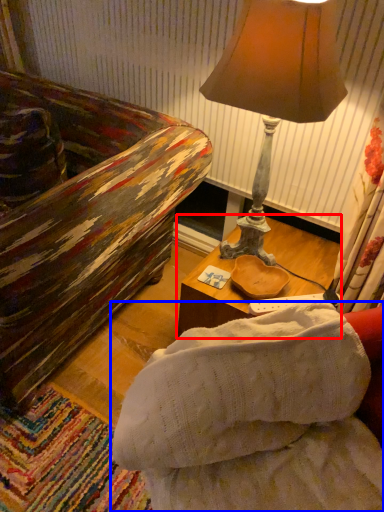
Question: Which object appears closest to the camera in this image, table (highlighted by a red box) or studio couch (highlighted by a blue box)?

Choices:
 (A) table
 (B) studio couch

Answer: (B)